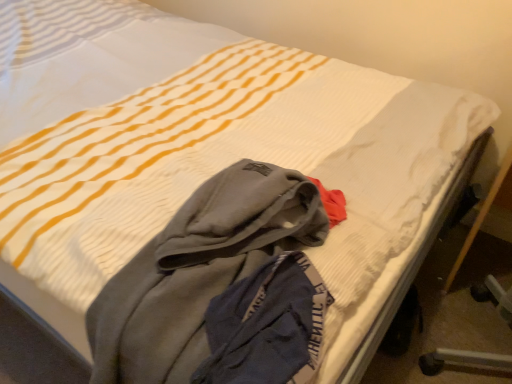
This screenshot has width=512, height=384. I want to click on wooden bed frame at lower right, so click(x=413, y=264).

Describe the element at coordinates (413, 264) in the screenshot. I see `wooden bed frame at lower right` at that location.

Based on the photo, measure the distance between point (374,338) and camera.

Point (374,338) and camera are 34.88 inches apart from each other.

Measure the distance between gray fleece hoodie at center and camera.

24.79 inches.

Image resolution: width=512 pixels, height=384 pixels. Describe the element at coordinates (198, 270) in the screenshot. I see `gray fleece hoodie at center` at that location.

I want to click on gray fleece hoodie at center, so click(198, 270).

Image resolution: width=512 pixels, height=384 pixels. I want to click on wooden bed frame at lower right, so click(x=413, y=264).

Can you confirm if gray fleece hoodie at center is positioned to the right of wooden bed frame at lower right?

No, gray fleece hoodie at center is not to the right of wooden bed frame at lower right.

Which object is closer to the camera taking this photo, gray fleece hoodie at center or wooden bed frame at lower right?

gray fleece hoodie at center is in front.

Is point (270, 252) in front of point (386, 315)?

Yes, point (270, 252) is closer to viewer.

From the image's perspective, is gray fleece hoodie at center under wooden bed frame at lower right?

Correct, gray fleece hoodie at center appears lower than wooden bed frame at lower right in the image.

From a real-world perspective, is gray fleece hoodie at center positioned under wooden bed frame at lower right based on gravity?

No.

From the picture: Considering the sizes of objects gray fleece hoodie at center and wooden bed frame at lower right in the image provided, who is wider, gray fleece hoodie at center or wooden bed frame at lower right?

With larger width is wooden bed frame at lower right.

Does gray fleece hoodie at center have a greater height compared to wooden bed frame at lower right?

Incorrect, the height of gray fleece hoodie at center is not larger of that of wooden bed frame at lower right.

Considering the relative sizes of gray fleece hoodie at center and wooden bed frame at lower right in the image provided, is gray fleece hoodie at center bigger than wooden bed frame at lower right?

Incorrect, gray fleece hoodie at center is not larger than wooden bed frame at lower right.

Is gray fleece hoodie at center not inside wooden bed frame at lower right?

Absolutely, gray fleece hoodie at center is external to wooden bed frame at lower right.

Consider the image. Is there a large distance between gray fleece hoodie at center and wooden bed frame at lower right?

No, gray fleece hoodie at center is not far away from wooden bed frame at lower right.

Is wooden bed frame at lower right at the back of gray fleece hoodie at center?

No, gray fleece hoodie at center is not facing away from wooden bed frame at lower right.

Where is `laundry positioned vertically above the wooden bed frame at lower right (from a real-world perspective)`? laundry positioned vertically above the wooden bed frame at lower right (from a real-world perspective) is located at coordinates (198, 270).

Which is more to the left, wooden bed frame at lower right or gray fleece hoodie at center?

gray fleece hoodie at center.

Is the depth of wooden bed frame at lower right less than that of gray fleece hoodie at center?

No, it is not.

Does point (393, 305) come behind point (154, 251)?

That is True.

From the image's perspective, is wooden bed frame at lower right on top of gray fleece hoodie at center?

Yes, from the image's perspective, wooden bed frame at lower right is over gray fleece hoodie at center.

From a real-world perspective, is wooden bed frame at lower right positioned above or below gray fleece hoodie at center?

wooden bed frame at lower right is below gray fleece hoodie at center.

Can you confirm if wooden bed frame at lower right is thinner than gray fleece hoodie at center?

No, wooden bed frame at lower right is not thinner than gray fleece hoodie at center.

Is wooden bed frame at lower right taller than gray fleece hoodie at center?

Yes.

Who is bigger, wooden bed frame at lower right or gray fleece hoodie at center?

Bigger between the two is wooden bed frame at lower right.

Would you say wooden bed frame at lower right is outside gray fleece hoodie at center?

wooden bed frame at lower right is positioned outside gray fleece hoodie at center.

Are wooden bed frame at lower right and gray fleece hoodie at center beside each other?

No, wooden bed frame at lower right is not in contact with gray fleece hoodie at center.

Could you tell me if wooden bed frame at lower right is facing gray fleece hoodie at center?

No.

What's the angular difference between wooden bed frame at lower right and gray fleece hoodie at center's facing directions?

There is a 139-degree angle between the facing directions of wooden bed frame at lower right and gray fleece hoodie at center.

Identify the location of bed frame on the right of gray fleece hoodie at center. pos(413,264).

Where is `bed frame located on the right of gray fleece hoodie at center`? This screenshot has height=384, width=512. bed frame located on the right of gray fleece hoodie at center is located at coordinates (413, 264).

Locate an element on the screen. The width and height of the screenshot is (512, 384). laundry in front of the wooden bed frame at lower right is located at coordinates (198, 270).